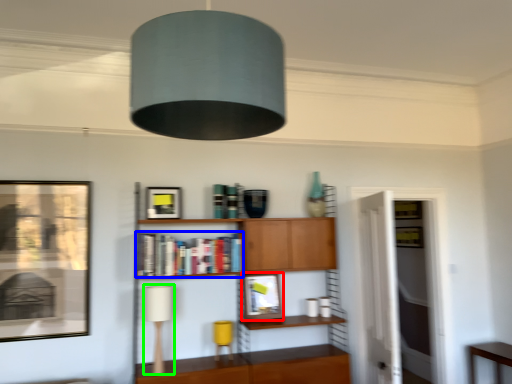
Question: Which is farther away from picture frame (highlighted by a red box)? book (highlighted by a blue box) or table lamp (highlighted by a green box)?

Choices:
 (A) book
 (B) table lamp

Answer: (B)